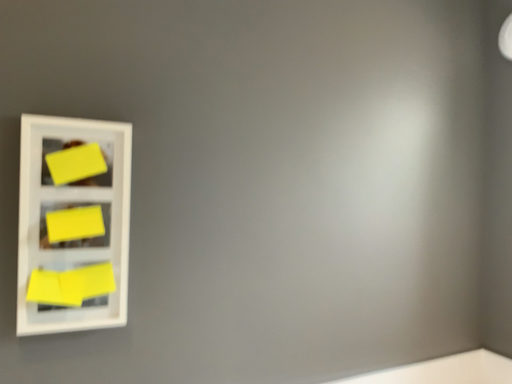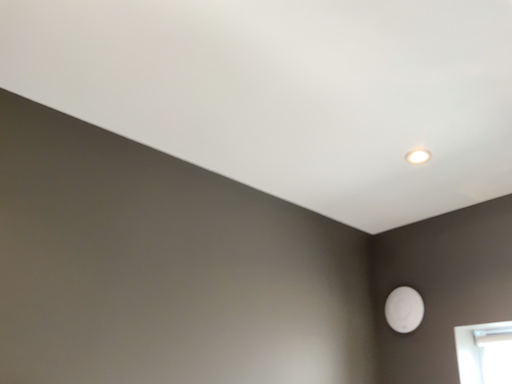
Question: How did the camera likely rotate when shooting the video?

Choices:
 (A) rotated downward
 (B) rotated upward

Answer: (B)